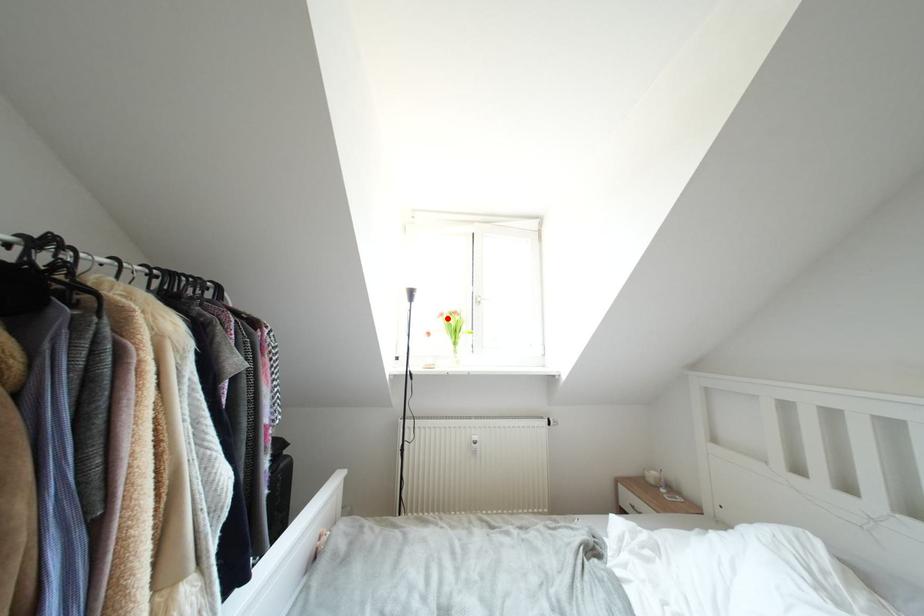
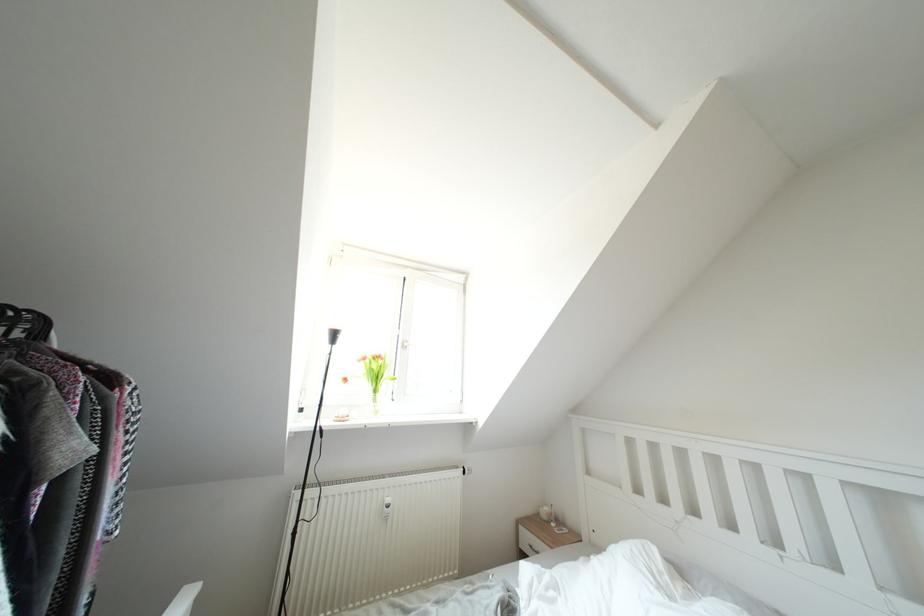
Find the pixel in the second image that matches the highlighted location in the first image.

(370, 363)